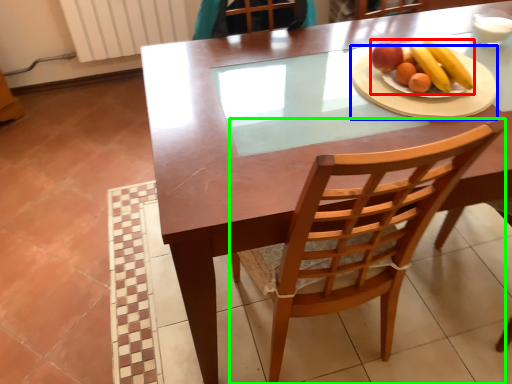
Question: Based on their relative distances, which object is nearer to fruit dish (highlighted by a red box)? Choose from platter (highlighted by a blue box) and chair (highlighted by a green box).

Choices:
 (A) platter
 (B) chair

Answer: (A)